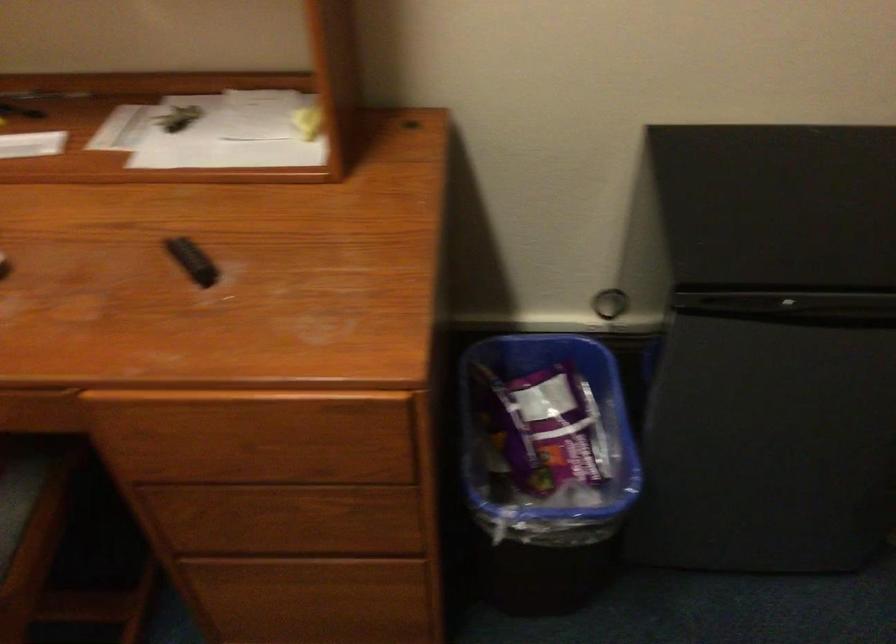
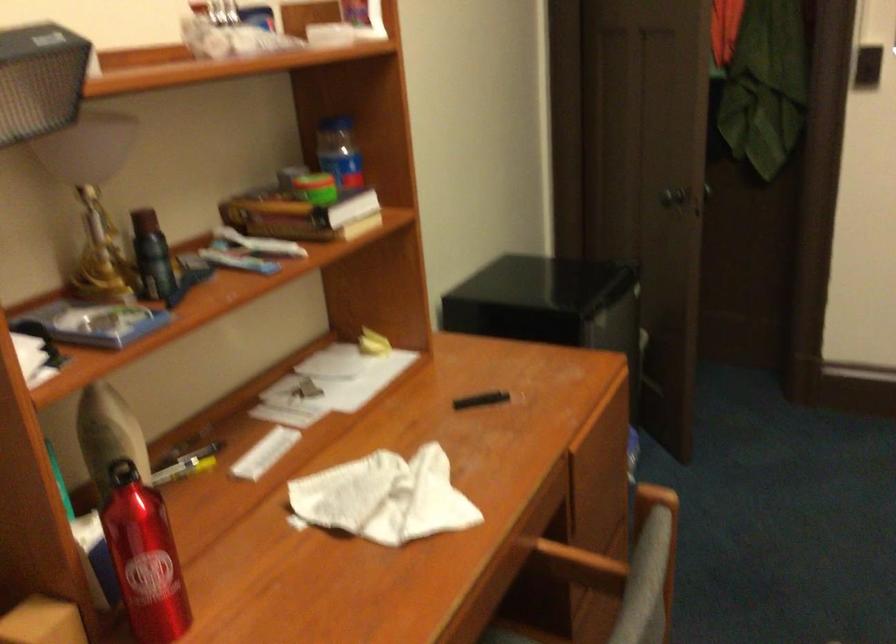
In the second image, find the point that corresponds to [201,258] in the first image.

(480, 400)